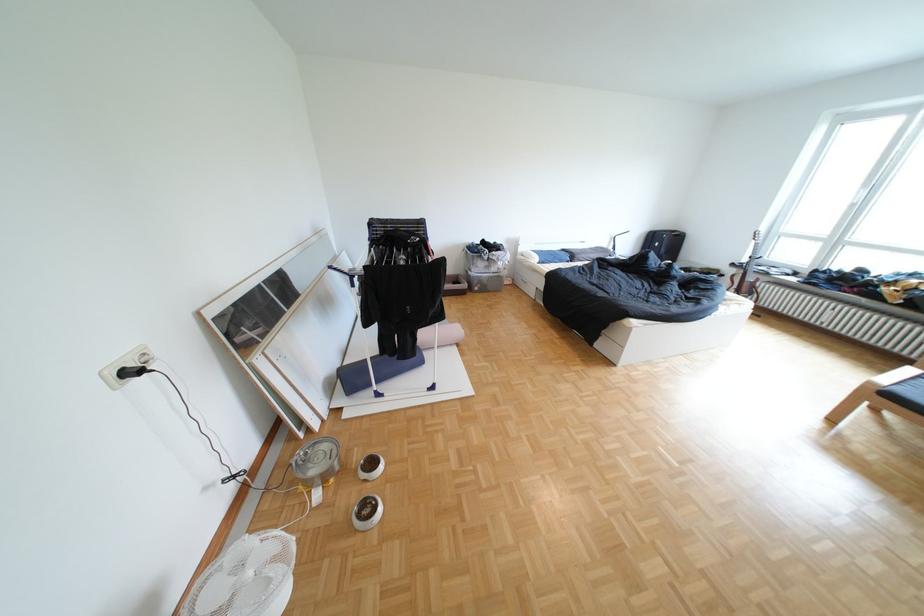
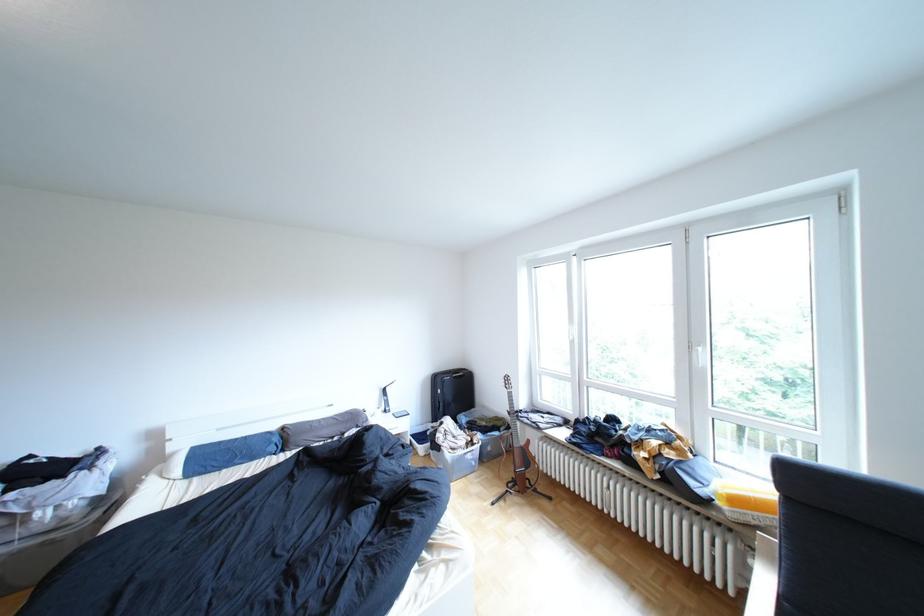
Locate, in the second image, the point that corresponds to pixel 575 248 in the first image.

(289, 427)